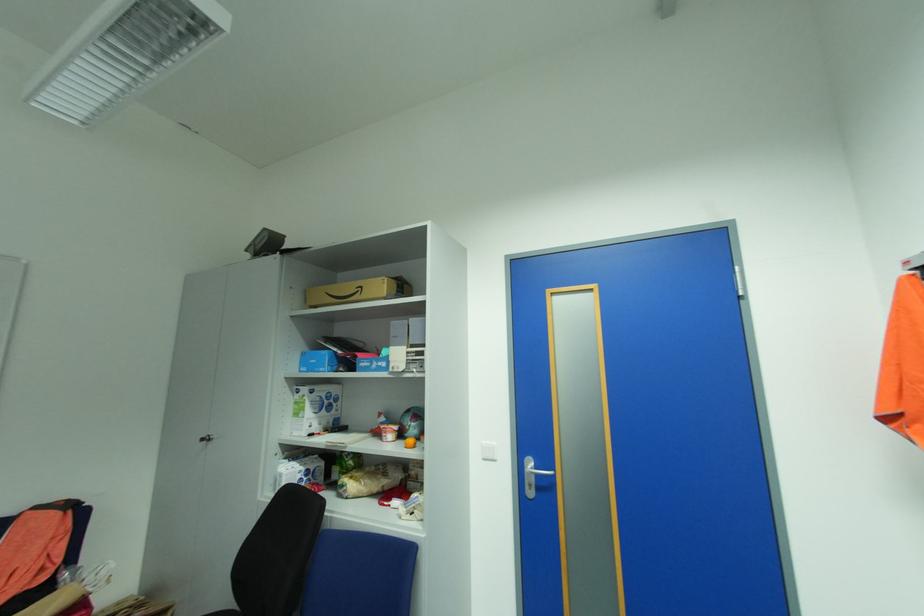
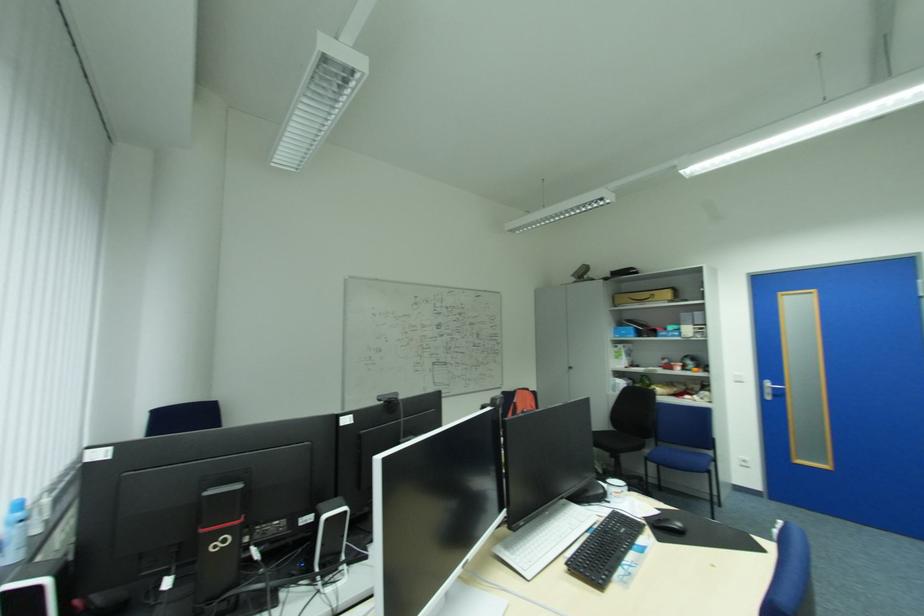
Where in the second image is the point corresponding to (x=537, y=464) from the first image?

(774, 384)